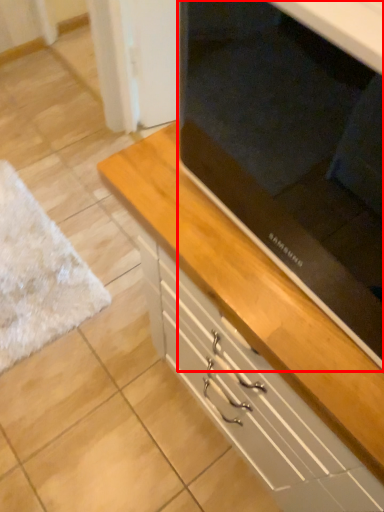
Question: From the image's perspective, considering the relative positions of appliance (annotated by the red box) and chest of drawers in the image provided, where is appliance (annotated by the red box) located with respect to the staircase?

Choices:
 (A) above
 (B) below

Answer: (A)